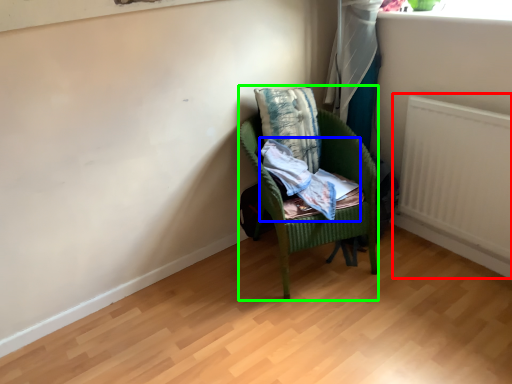
Question: Based on their relative distances, which object is farther from radiator (highlighted by a red box)? Choose from clothing (highlighted by a blue box) and chair (highlighted by a green box).

Choices:
 (A) clothing
 (B) chair

Answer: (A)